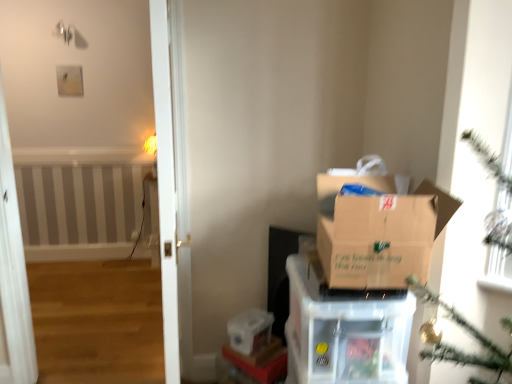
You are a GUI agent. You are given a task and a screenshot of the screen. Output one action in this format:
    pyautogui.click(x=<x>, y=<y>)
    Task: Click on the brown cardboard box at center
    Image resolution: width=512 pixels, height=384 pixels.
    Given the screenshot: What is the action you would take?
    pyautogui.click(x=344, y=332)

What is the approximate height of brown cardboard box at right?

brown cardboard box at right is 12.95 inches in height.

Describe the element at coordinates (379, 233) in the screenshot. Image resolution: width=512 pixels, height=384 pixels. I see `brown cardboard box at right` at that location.

The image size is (512, 384). What do you see at coordinates (250, 331) in the screenshot? I see `clear plastic storage box at lower center` at bounding box center [250, 331].

Locate an element on the screen. clear plastic storage box at lower center is located at coordinates (250, 331).

Identify the location of clear plastic container at lower center. The width and height of the screenshot is (512, 384). (261, 361).

Is point (383, 221) positioned in front of point (266, 350)?

Yes, point (383, 221) is in front of point (266, 350).

Is brown cardboard box at right thinner than clear plastic container at lower center?

No, brown cardboard box at right is not thinner than clear plastic container at lower center.

Choose the correct answer: Is brown cardboard box at right inside clear plastic container at lower center or outside it?

brown cardboard box at right is not inside clear plastic container at lower center, it's outside.

Considering the sizes of objects brown cardboard box at center and clear plastic storage box at lower center in the image provided, who is bigger, brown cardboard box at center or clear plastic storage box at lower center?

With larger size is brown cardboard box at center.

From the image's perspective, between brown cardboard box at center and clear plastic storage box at lower center, who is located below?

From the image's view, clear plastic storage box at lower center is below.

Does brown cardboard box at center touch clear plastic storage box at lower center?

No, brown cardboard box at center is not beside clear plastic storage box at lower center.

Based on the photo, is brown cardboard box at center aimed at clear plastic storage box at lower center?

No.

Between clear plastic storage box at lower center and brown cardboard box at right, which one has smaller size?

clear plastic storage box at lower center is smaller.

Does clear plastic storage box at lower center have a greater width compared to brown cardboard box at right?

No, clear plastic storage box at lower center is not wider than brown cardboard box at right.

Is point (256, 335) positioned after point (448, 211)?

Yes, it is.

Measure the distance from clear plastic storage box at lower center to brown cardboard box at right.

clear plastic storage box at lower center and brown cardboard box at right are 35.07 inches apart.

From the picture: Is clear plastic storage box at lower center located outside brown cardboard box at center?

Indeed, clear plastic storage box at lower center is completely outside brown cardboard box at center.

Identify the location of cardboard box above the clear plastic storage box at lower center (from a real-world perspective). The width and height of the screenshot is (512, 384). (344, 332).

From a real-world perspective, relative to brown cardboard box at center, is clear plastic storage box at lower center vertically above or below?

From a real-world perspective, clear plastic storage box at lower center is physically below brown cardboard box at center.

Does point (249, 331) appear closer or farther from the camera than point (356, 323)?

Point (249, 331) is farther from the camera than point (356, 323).

Is brown cardboard box at center facing towards clear plastic container at lower center?

No, brown cardboard box at center is not oriented towards clear plastic container at lower center.

In the scene shown: Is brown cardboard box at center with clear plastic container at lower center?

No, brown cardboard box at center is not touching clear plastic container at lower center.

Can you confirm if brown cardboard box at center is thinner than clear plastic container at lower center?

No, brown cardboard box at center is not thinner than clear plastic container at lower center.

Is clear plastic container at lower center wider than brown cardboard box at center?

No.

From the image's perspective, which is below, clear plastic container at lower center or brown cardboard box at center?

clear plastic container at lower center.

Could you tell me if clear plastic container at lower center is turned towards brown cardboard box at center?

No, clear plastic container at lower center is not facing towards brown cardboard box at center.

Considering the sizes of objects clear plastic storage box at lower center and clear plastic container at lower center in the image provided, who is shorter, clear plastic storage box at lower center or clear plastic container at lower center?

clear plastic container at lower center is shorter.

This screenshot has width=512, height=384. Find the location of `furniture that appears below the clear plastic storage box at lower center (from a real-world perspective)`. furniture that appears below the clear plastic storage box at lower center (from a real-world perspective) is located at coordinates (261, 361).

From the image's perspective, is clear plastic storage box at lower center located above or below clear plastic container at lower center?

Clearly, from the image's perspective, clear plastic storage box at lower center is above clear plastic container at lower center.

Where is `furniture beneath the brown cardboard box at right (from a real-world perspective)`? The width and height of the screenshot is (512, 384). furniture beneath the brown cardboard box at right (from a real-world perspective) is located at coordinates (261, 361).

Where is `cardboard box on the right of clear plastic storage box at lower center`? Image resolution: width=512 pixels, height=384 pixels. cardboard box on the right of clear plastic storage box at lower center is located at coordinates (344, 332).

From the image, which object appears to be farther from clear plastic container at lower center, brown cardboard box at center or clear plastic storage box at lower center?

brown cardboard box at center is further to clear plastic container at lower center.

Based on their spatial positions, is brown cardboard box at right or brown cardboard box at center further from clear plastic storage box at lower center?

The object further to clear plastic storage box at lower center is brown cardboard box at right.

From the image, which object appears to be farther from clear plastic storage box at lower center, clear plastic container at lower center or brown cardboard box at right?

brown cardboard box at right.

From the image, which object appears to be farther from brown cardboard box at right, clear plastic storage box at lower center or brown cardboard box at center?

clear plastic storage box at lower center.

Which object lies further to the anchor point brown cardboard box at right, clear plastic storage box at lower center or clear plastic container at lower center?

clear plastic container at lower center is further to brown cardboard box at right.

Which object lies further to the anchor point brown cardboard box at center, clear plastic container at lower center or brown cardboard box at right?

The object further to brown cardboard box at center is clear plastic container at lower center.

Looking at the image, which one is located closer to clear plastic container at lower center, brown cardboard box at right or brown cardboard box at center?

The object closer to clear plastic container at lower center is brown cardboard box at center.

Considering their positions, is brown cardboard box at right positioned further to brown cardboard box at center than clear plastic storage box at lower center?

Among the two, clear plastic storage box at lower center is located further to brown cardboard box at center.

Find the location of a particular element. storage box between brown cardboard box at center and clear plastic container at lower center in the front-back direction is located at coordinates tap(250, 331).

Where is `cardboard box between brown cardboard box at right and clear plastic container at lower center from top to bottom`? The height and width of the screenshot is (384, 512). cardboard box between brown cardboard box at right and clear plastic container at lower center from top to bottom is located at coordinates pos(344,332).

In order to click on cardboard box positioned between brown cardboard box at right and clear plastic storage box at lower center from near to far in this screenshot , I will do `click(344, 332)`.

Locate an element on the screen. storage box between brown cardboard box at right and clear plastic container at lower center in the up-down direction is located at coordinates (250, 331).